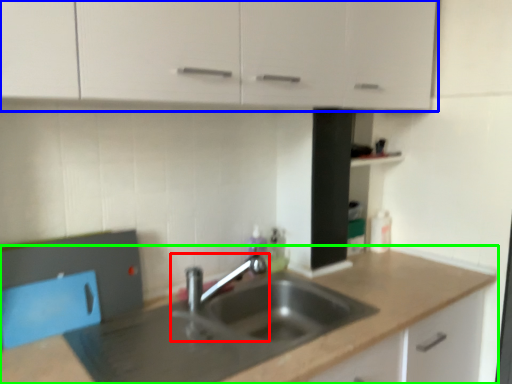
Question: Estimate the real-world distances between objects in this image. Which object is farther from tap (highlighted by a red box), cabinetry (highlighted by a blue box) or countertop (highlighted by a green box)?

Choices:
 (A) cabinetry
 (B) countertop

Answer: (A)